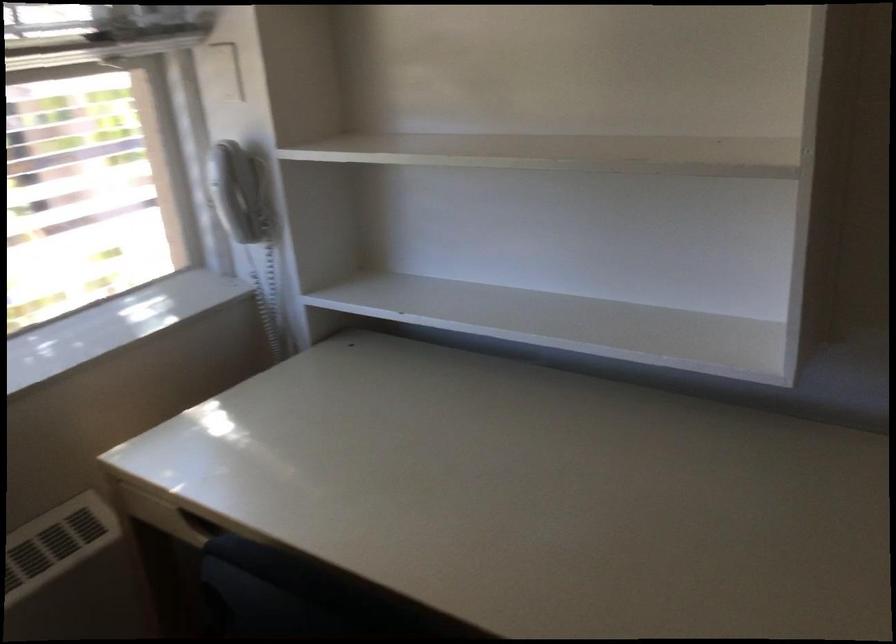
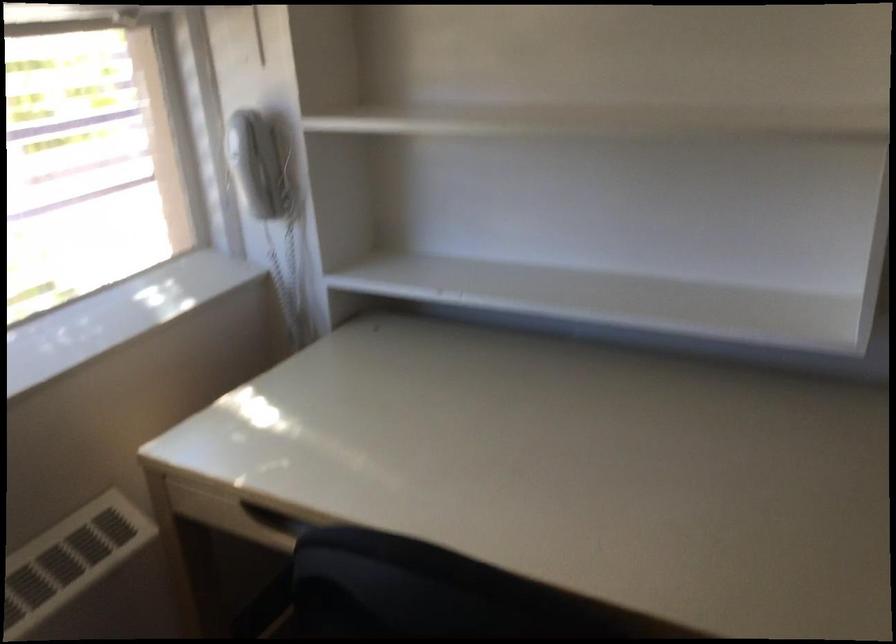
Question: How did the camera likely rotate?

Choices:
 (A) Left
 (B) Right
 (C) Up
 (D) Down

Answer: (B)